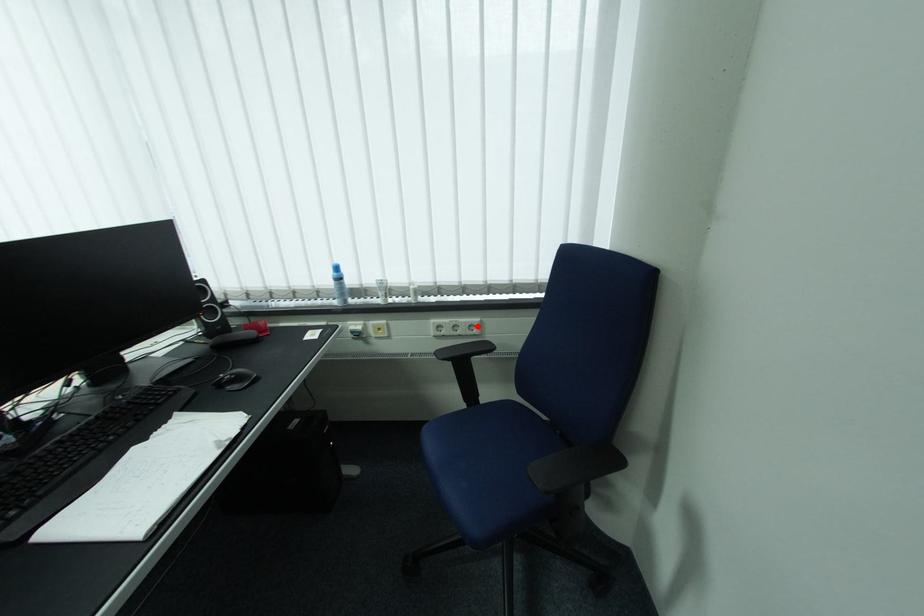
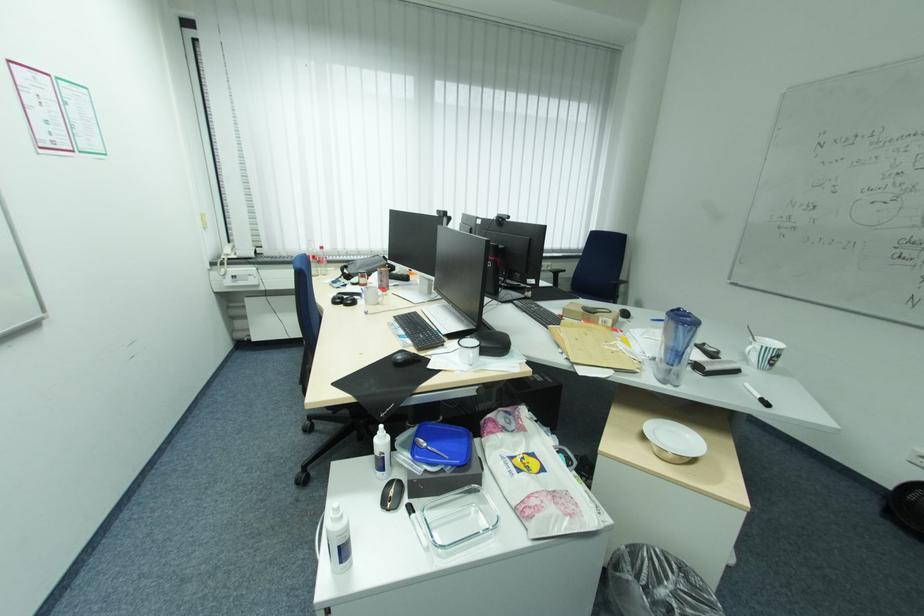
The point at the highlighted location is marked in the first image. Where is the corresponding point in the second image?

(554, 265)